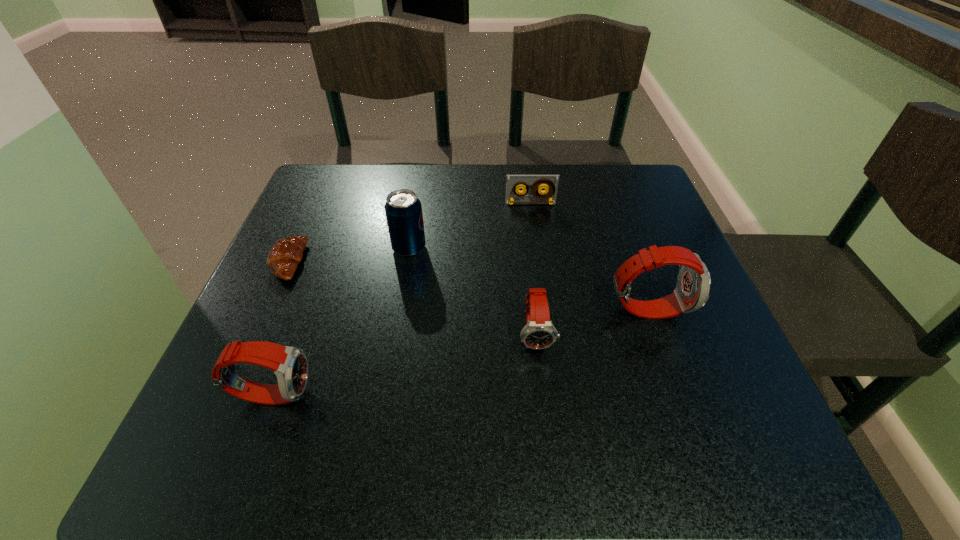
Locate an element on the screen. The width and height of the screenshot is (960, 540). the second tallest watch is located at coordinates (290, 365).

Identify the location of the nearest watch. (290, 365).

Where is `the shortest watch`? This screenshot has height=540, width=960. the shortest watch is located at coordinates (539, 332).

Find the location of a particular element. The width and height of the screenshot is (960, 540). the second watch from left to right is located at coordinates (539, 332).

Identify the location of the rightmost object. Image resolution: width=960 pixels, height=540 pixels. (692, 291).

Locate an element on the screen. The width and height of the screenshot is (960, 540). the tallest watch is located at coordinates (692, 291).

Where is `the farthest object`? the farthest object is located at coordinates (513, 182).

Locate an element on the screen. This screenshot has width=960, height=540. the fifth tallest object is located at coordinates (513, 182).

At what (x,y) coordinates should I click in order to perform the action: click on the shortest object. Please return your answer as a coordinate pair (x, y). The height and width of the screenshot is (540, 960). Looking at the image, I should click on (285, 255).

Locate an element on the screen. The image size is (960, 540). the fourth object from right to left is located at coordinates (403, 209).